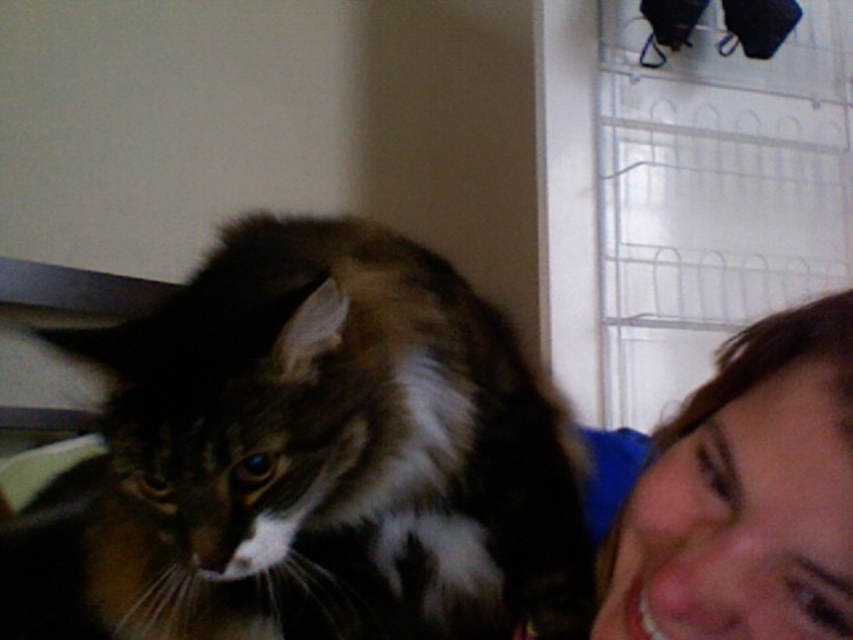
Between fuzzy brown cat at left and smooth skin face at lower right, which one appears on the left side from the viewer's perspective?

fuzzy brown cat at left is more to the left.

In order to click on fuzzy brown cat at left in this screenshot , I will do `click(334, 442)`.

Find the location of `fuzzy brown cat at left`. fuzzy brown cat at left is located at coordinates (334, 442).